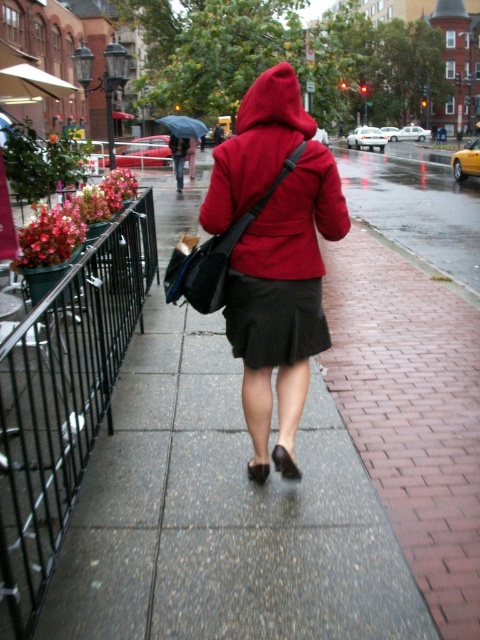
Question: Which object is the farthest from the black metal fence at left?

Choices:
 (A) concrete sidewalk at center
 (B) black satin skirt at center

Answer: (A)

Question: Can you confirm if black metal fence at left is thinner than matte red hoodie at center?

Choices:
 (A) no
 (B) yes

Answer: (A)

Question: Can you confirm if concrete sidewalk at center is positioned above matte red hoodie at center?

Choices:
 (A) no
 (B) yes

Answer: (A)

Question: Which object appears farthest from the camera in this image?

Choices:
 (A) black satin skirt at center
 (B) concrete sidewalk at center

Answer: (A)

Question: Which object appears farthest from the camera in this image?

Choices:
 (A) matte red hoodie at center
 (B) black satin skirt at center
 (C) concrete sidewalk at center

Answer: (B)

Question: Can you confirm if black metal fence at left is thinner than matte red hoodie at center?

Choices:
 (A) no
 (B) yes

Answer: (A)